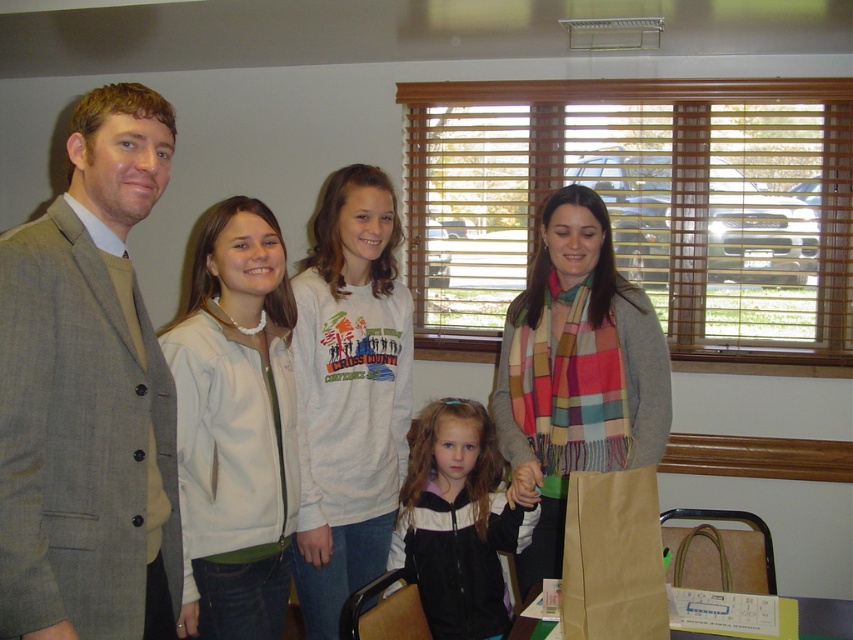
Between point (518, 352) and point (583, 513), which one is positioned behind?

The point (518, 352) is behind.

Who is taller, multicolored plaid scarf at center or brown paper bag at lower center?

Standing taller between the two is multicolored plaid scarf at center.

At what (x,y) coordinates should I click in order to perform the action: click on multicolored plaid scarf at center. Please return your answer as a coordinate pair (x, y). This screenshot has width=853, height=640. Looking at the image, I should click on (577, 371).

Is white fleece jacket at center shorter than black matte jacket at center?

In fact, white fleece jacket at center may be taller than black matte jacket at center.

Who is taller, white fleece jacket at center or black matte jacket at center?

With more height is white fleece jacket at center.

The image size is (853, 640). I want to click on white fleece jacket at center, so click(84, 390).

From the picture: Between white matte jacket at center and white cotton sweatshirt at center, which one is positioned higher?

white cotton sweatshirt at center is above.

Who is shorter, white matte jacket at center or white cotton sweatshirt at center?

white matte jacket at center

Between point (198, 621) and point (306, 618), which one is positioned behind?

The point (306, 618) is behind.

Locate an element on the screen. white matte jacket at center is located at coordinates (235, 426).